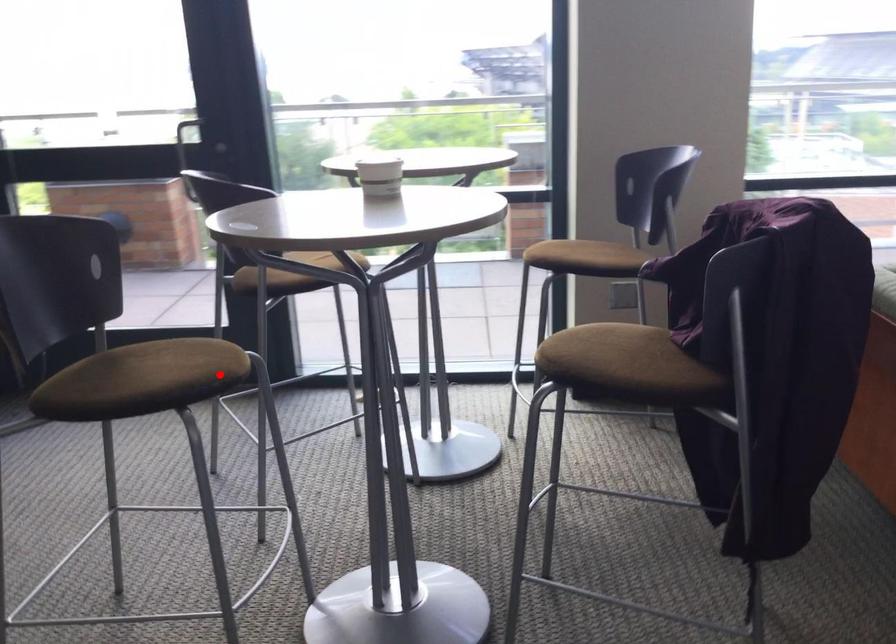
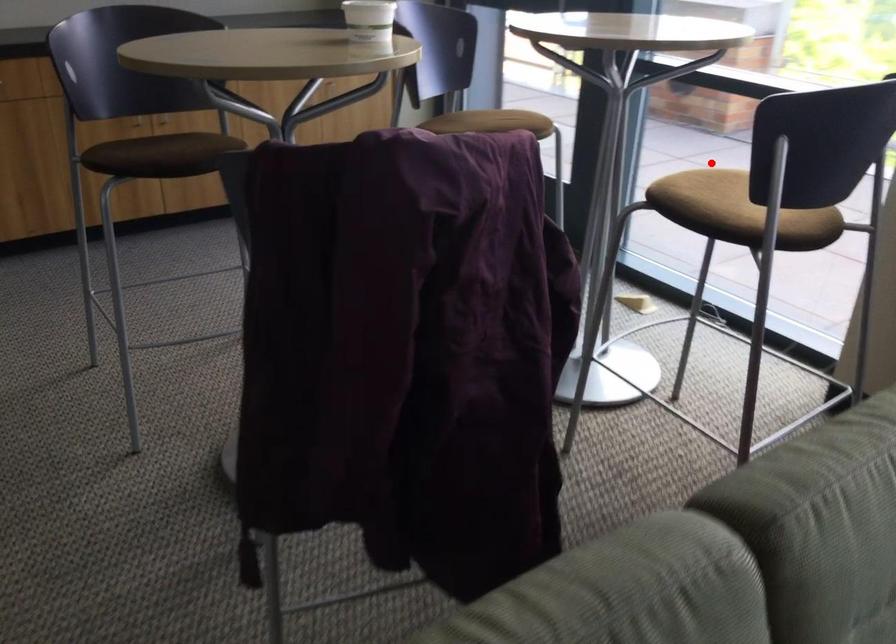
Based on the photo, I am providing you with two images of the same scene from different viewpoints. A red point is marked on the first image and another point is marked on the second image. Is the red point in image1 aligned with the point shown in image2?

No